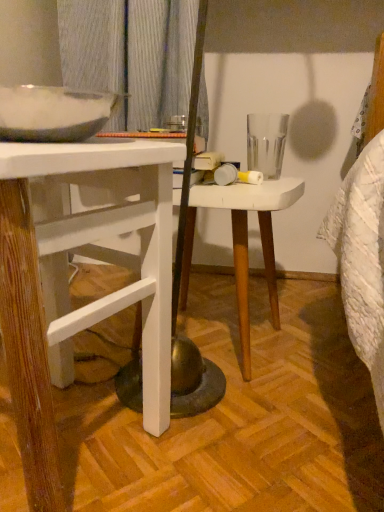
Question: Is white matte stool at center taller or shorter than white wood desk at left?

Choices:
 (A) short
 (B) tall

Answer: (A)

Question: Is white matte stool at center bigger or smaller than white wood desk at left?

Choices:
 (A) small
 (B) big

Answer: (A)

Question: Is white matte stool at center in front of or behind white wood desk at left in the image?

Choices:
 (A) front
 (B) behind

Answer: (B)

Question: From their relative heights in the image, would you say white wood desk at left is taller or shorter than white matte stool at center?

Choices:
 (A) tall
 (B) short

Answer: (A)

Question: In terms of width, does white wood desk at left look wider or thinner when compared to white matte stool at center?

Choices:
 (A) wide
 (B) thin

Answer: (A)

Question: From a real-world perspective, is white wood desk at left physically located above or below white matte stool at center?

Choices:
 (A) above
 (B) below

Answer: (A)

Question: Based on their positions, is white wood desk at left located to the left or right of white matte stool at center?

Choices:
 (A) left
 (B) right

Answer: (A)